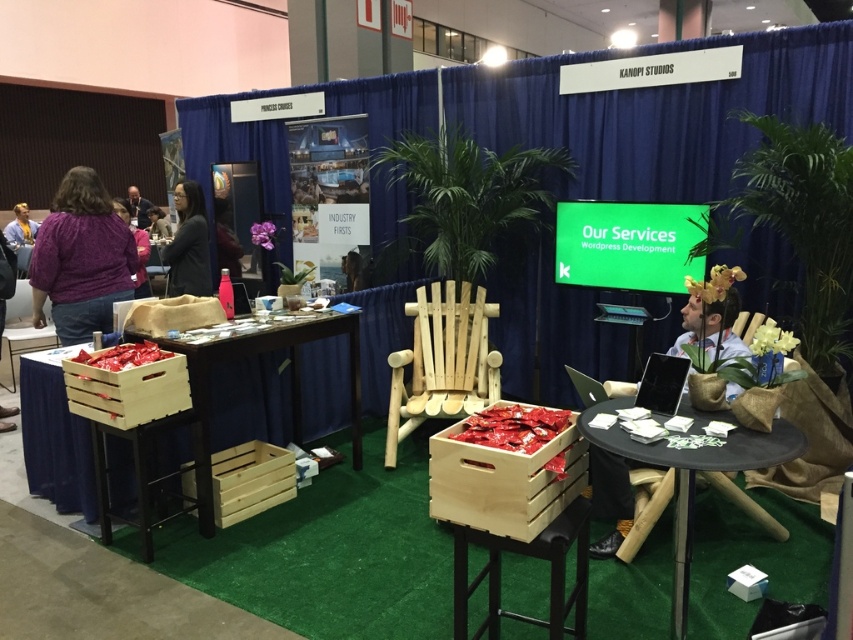
Between point (271, 346) and point (738, 308), which one is positioned in front?

Point (738, 308)

Is wooden crates at lower left shorter than wooden chair at center?

No.

Is point (202, 449) farther from camera compared to point (630, 524)?

Yes, point (202, 449) is farther from viewer.

What are the coordinates of `wooden crates at lower left` in the screenshot? It's located at point(251,355).

Between point (723, 276) and point (141, 209), which one is positioned behind?

Point (141, 209)

Between point (604, 480) and point (151, 205), which one is positioned in front?

Positioned in front is point (604, 480).

Locate an element on the screen. The image size is (853, 640). wooden chair at center is located at coordinates tap(712, 320).

Is black wood table at center further to the viewer compared to black glossy laptop at center?

That is False.

Can you confirm if black wood table at center is positioned above black glossy laptop at center?

No, black wood table at center is not above black glossy laptop at center.

Between point (683, 548) and point (670, 401), which one is positioned in front?

Point (683, 548) is more forward.

What are the coordinates of `black wood table at center` in the screenshot? It's located at click(x=693, y=476).